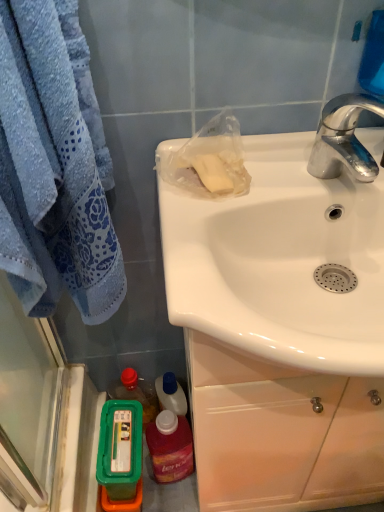
Question: Is translucent plastic mouthwash at lower left, the second mouthwash when ordered from left to right, completely or partially outside of chrome metallic faucet at upper right?

Choices:
 (A) no
 (B) yes

Answer: (B)

Question: Can you confirm if translucent plastic mouthwash at lower left, the second mouthwash when ordered from left to right, is taller than chrome metallic faucet at upper right?

Choices:
 (A) no
 (B) yes

Answer: (B)

Question: Does translucent plastic mouthwash at lower left, the second mouthwash when ordered from left to right, have a larger size compared to chrome metallic faucet at upper right?

Choices:
 (A) no
 (B) yes

Answer: (B)

Question: From the image's perspective, does translucent plastic mouthwash at lower left, the second mouthwash when ordered from left to right, appear higher than chrome metallic faucet at upper right?

Choices:
 (A) no
 (B) yes

Answer: (A)

Question: Is chrome metallic faucet at upper right surrounded by translucent plastic mouthwash at lower left, the first mouthwash from the right?

Choices:
 (A) no
 (B) yes

Answer: (A)

Question: From a real-world perspective, is green plastic container at lower left physically located above or below translucent plastic mouthwash at lower left, the first mouthwash from the right?

Choices:
 (A) below
 (B) above

Answer: (A)

Question: Based on their positions, is green plastic container at lower left located to the left or right of translucent plastic mouthwash at lower left, the second mouthwash when ordered from left to right?

Choices:
 (A) right
 (B) left

Answer: (B)

Question: Is green plastic container at lower left wider or thinner than translucent plastic mouthwash at lower left, the second mouthwash when ordered from left to right?

Choices:
 (A) thin
 (B) wide

Answer: (A)

Question: Considering their positions, is green plastic container at lower left located in front of or behind translucent plastic mouthwash at lower left, the first mouthwash from the right?

Choices:
 (A) front
 (B) behind

Answer: (B)

Question: From their relative heights in the image, would you say translucent plastic mouthwash at lower left, the first mouthwash from the right, is taller or shorter than chrome metallic faucet at upper right?

Choices:
 (A) short
 (B) tall

Answer: (B)

Question: From a real-world perspective, relative to chrome metallic faucet at upper right, is translucent plastic mouthwash at lower left, the first mouthwash from the right, vertically above or below?

Choices:
 (A) below
 (B) above

Answer: (A)

Question: In terms of width, does translucent plastic mouthwash at lower left, the first mouthwash from the right, look wider or thinner when compared to chrome metallic faucet at upper right?

Choices:
 (A) thin
 (B) wide

Answer: (A)

Question: Considering their positions, is translucent plastic mouthwash at lower left, the second mouthwash when ordered from left to right, located in front of or behind chrome metallic faucet at upper right?

Choices:
 (A) front
 (B) behind

Answer: (B)

Question: From the image's perspective, is green plastic container at lower left, the 2th mouthwash viewed from the right, located above or below white glossy sink at upper right?

Choices:
 (A) above
 (B) below

Answer: (B)

Question: Relative to white glossy sink at upper right, is green plastic container at lower left, the 2th mouthwash viewed from the right, in front or behind?

Choices:
 (A) behind
 (B) front

Answer: (A)